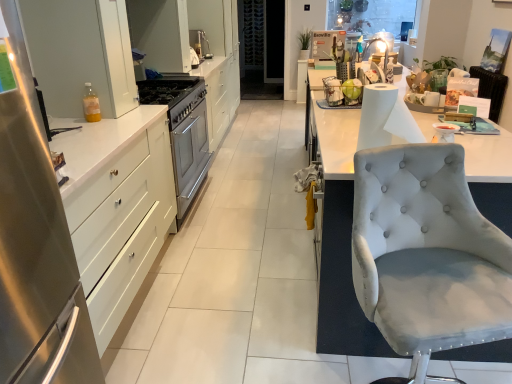
Locate an element on the screen. This screenshot has height=384, width=512. vacant space positioned to the left of translucent plastic bottle at left is located at coordinates (66, 115).